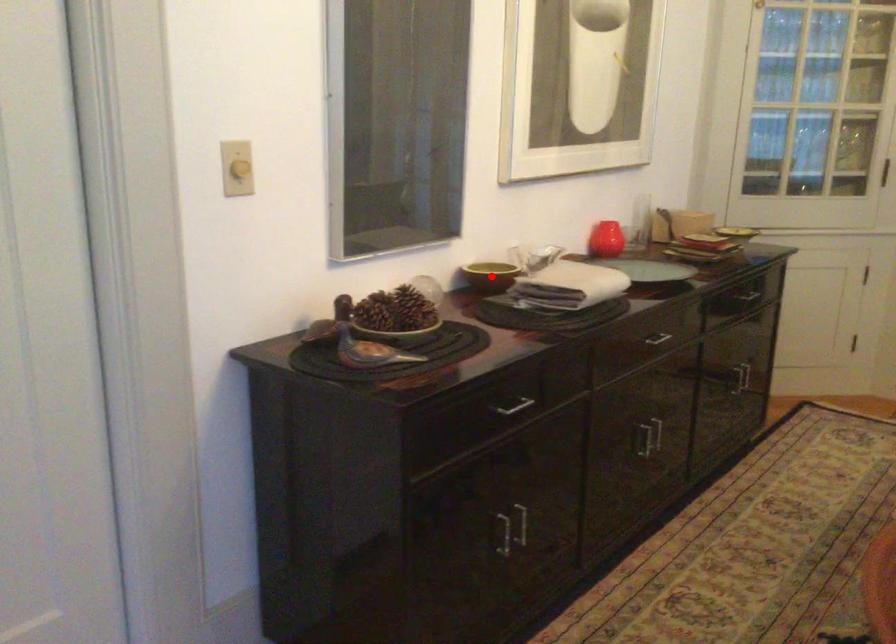
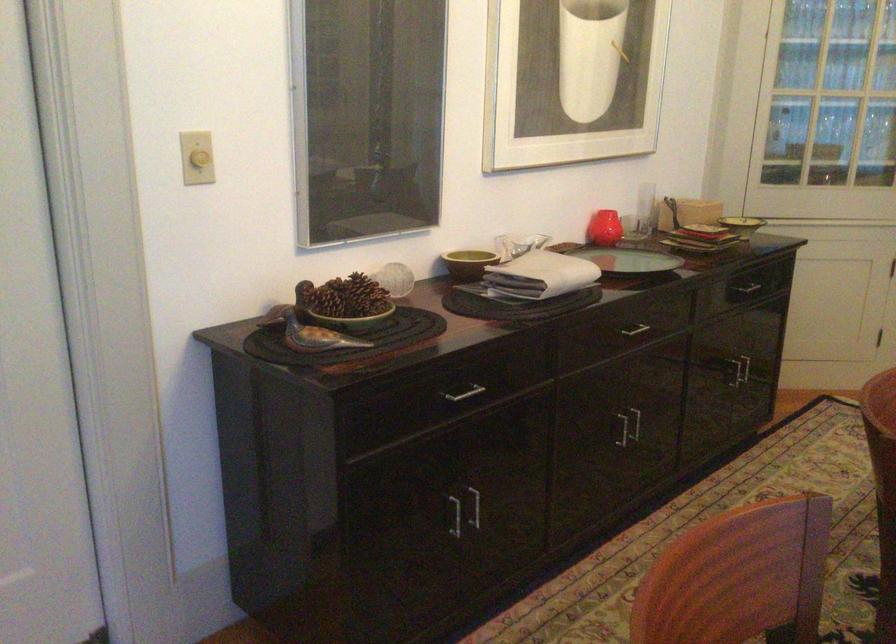
In the second image, find the point that corresponds to the highlighted location in the first image.

(468, 263)